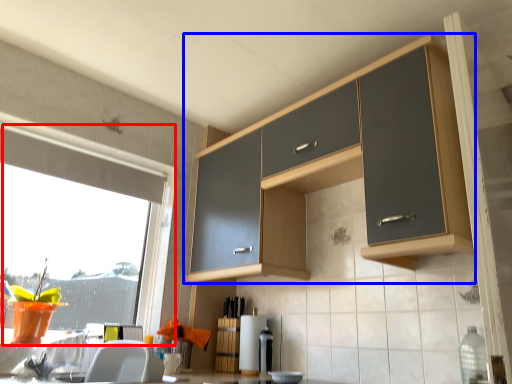
Question: Among these objects, which one is nearest to the camera, window (highlighted by a red box) or cabinetry (highlighted by a blue box)?

Choices:
 (A) window
 (B) cabinetry

Answer: (B)